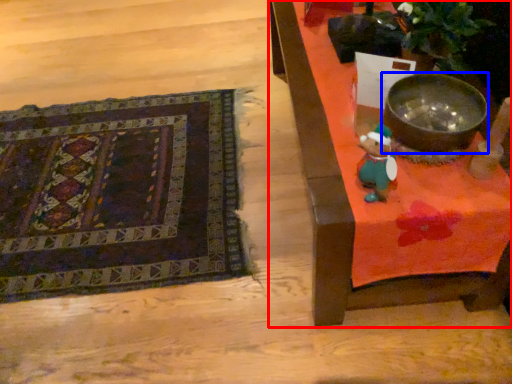
Question: Among these objects, which one is farthest to the camera, furniture (highlighted by a red box) or mixing bowl (highlighted by a blue box)?

Choices:
 (A) furniture
 (B) mixing bowl

Answer: (B)